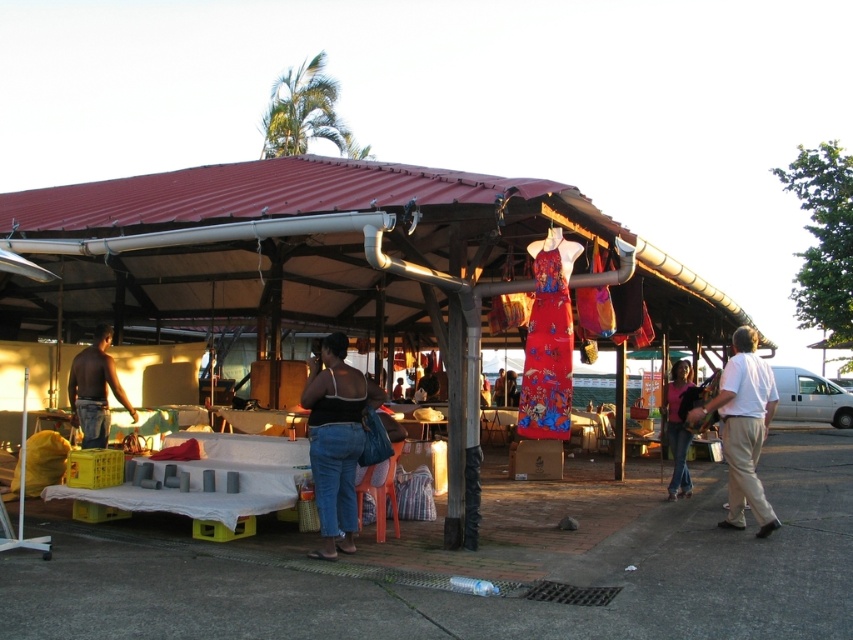
You are a vendor at the market and want to display the matte plastic dress at center and the black fabric dress at center on a single hanger. Which dress requires a wider hanger due to its size?

The matte plastic dress at center requires a wider hanger because its width is larger than the black fabric dress at center.

You are a customer in the market looking for the white cotton shirt at right. You see the matte plastic dress at center in your way. Which direction should you move to avoid the dress and reach the shirt?

The matte plastic dress at center is to the left of the white cotton shirt at right. To reach the shirt, move to the right side of the dress.